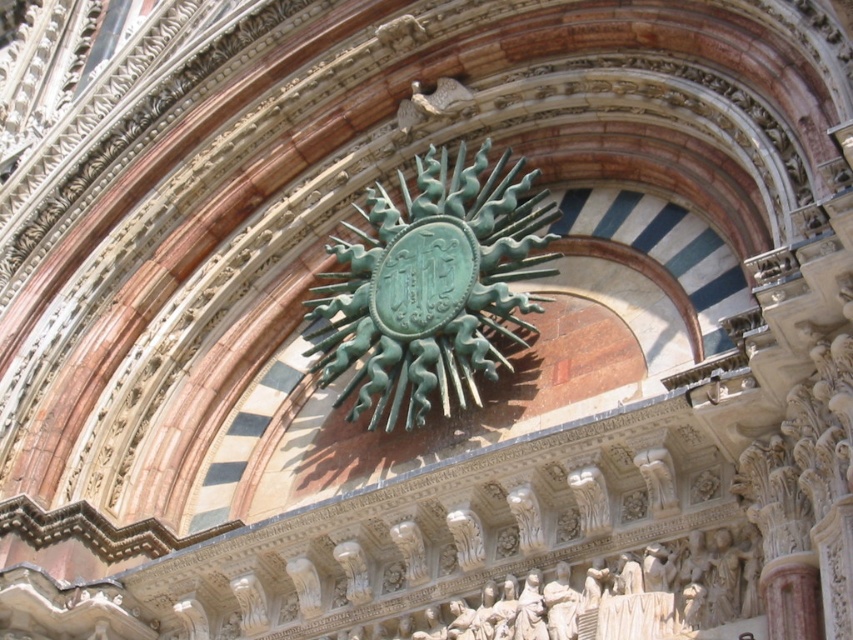
Who is positioned more to the right, white stone figures at lower center or white marble statue at lower center?

Positioned to the right is white stone figures at lower center.

Identify the location of white stone figures at lower center. Image resolution: width=853 pixels, height=640 pixels. (606, 595).

The image size is (853, 640). In order to click on white stone figures at lower center in this screenshot , I will do `click(606, 595)`.

Which is above, green patina metal sunburst at center or white marble statue at lower center?

green patina metal sunburst at center is higher up.

How much distance is there between green patina metal sunburst at center and white marble statue at lower center?

green patina metal sunburst at center and white marble statue at lower center are 45.00 feet apart from each other.

The image size is (853, 640). I want to click on green patina metal sunburst at center, so click(431, 285).

Is green patina eagle at upper center bigger than white marble statue at lower center?

A: Indeed, green patina eagle at upper center has a larger size compared to white marble statue at lower center.

Is point (405, 100) positioned before point (518, 600)?

No, it is behind (518, 600).

This screenshot has width=853, height=640. I want to click on green patina eagle at upper center, so click(431, 102).